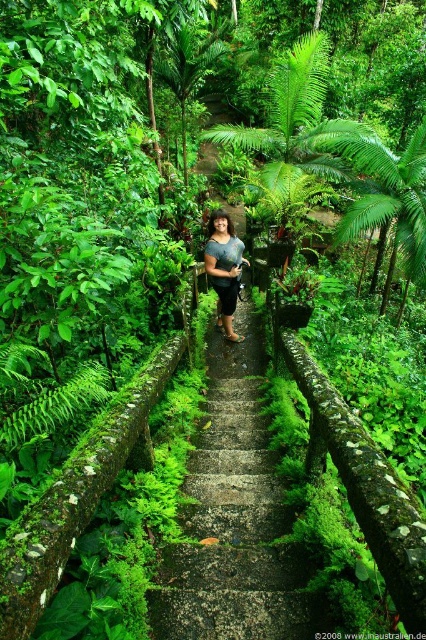
You are a photographer standing at a distance. You want to capture a clear photo of the green mossy stone steps at center without any blur. Considering the depth of field, what is the minimum focusing distance you should set your camera to ensure the steps are sharp?

The green mossy stone steps at center is 8.07 feet away from camera. To ensure the steps are in focus, set the camera focus distance to at least 8.07 feet.

You are a hiker who just arrived at the mossy staircase. You need to step onto the green mossy stone steps at center from the matte blue shirt at center. Which direction should you move to reach the steps?

You should move to the right because the green mossy stone steps at center are located to the right of the matte blue shirt at center.